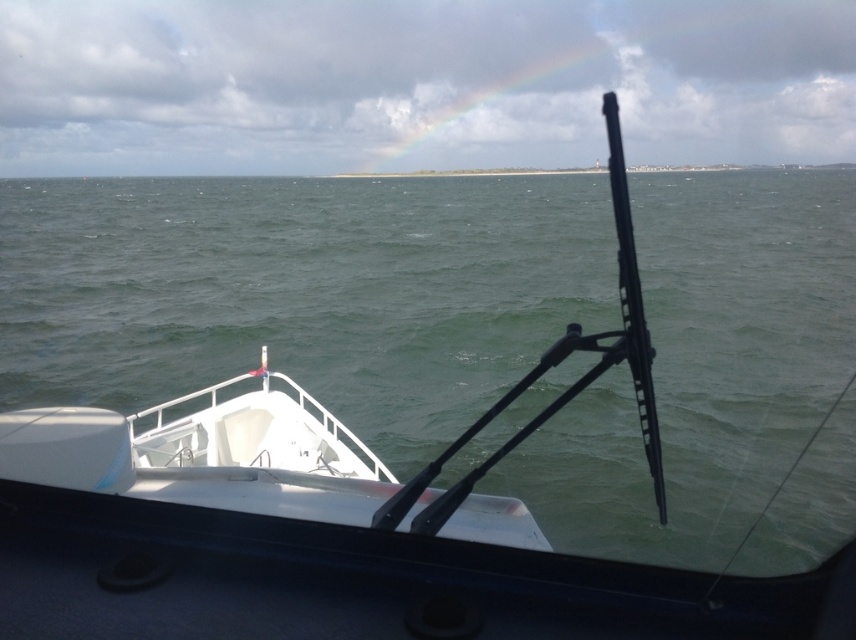
Question: Can you confirm if green matte water at center is smaller than white matte boat at lower left?

Choices:
 (A) no
 (B) yes

Answer: (A)

Question: Based on their relative distances, which object is farther from the white matte boat at lower left?

Choices:
 (A) rainbow at upper center
 (B) green matte water at center

Answer: (A)

Question: Is rainbow at upper center behind white matte boat at lower left?

Choices:
 (A) no
 (B) yes

Answer: (B)

Question: Which point is closer to the camera?

Choices:
 (A) green matte water at center
 (B) white matte boat at lower left
 (C) rainbow at upper center

Answer: (A)

Question: Can you confirm if rainbow at upper center is wider than white matte boat at lower left?

Choices:
 (A) no
 (B) yes

Answer: (B)

Question: Which object appears farthest from the camera in this image?

Choices:
 (A) green matte water at center
 (B) rainbow at upper center
 (C) white matte boat at lower left

Answer: (B)